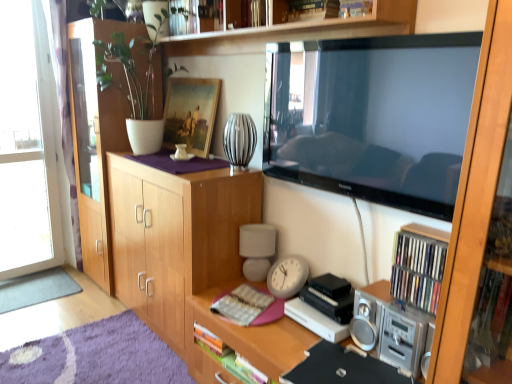
At what (x,y) coordinates should I click in order to perform the action: click on free spot above wooden desk at center (from a real-world perspective). Please return your answer as a coordinate pair (x, y). Looking at the image, I should click on click(x=292, y=326).